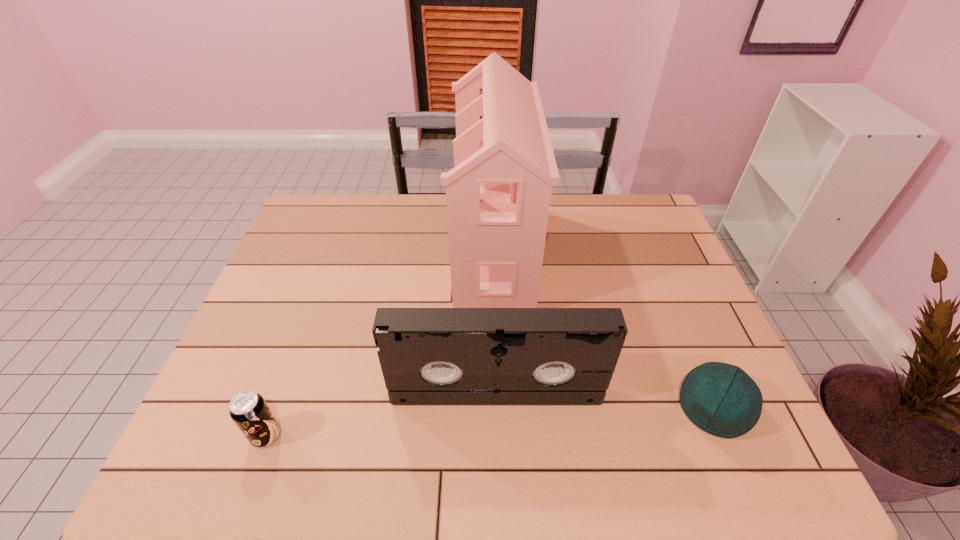
This screenshot has width=960, height=540. I want to click on the tallest object, so click(498, 194).

Locate an element on the screen. The image size is (960, 540). the farthest object is located at coordinates (498, 194).

Identify the location of the second tallest object. This screenshot has width=960, height=540. (428, 356).

Find the location of a particular element. The width and height of the screenshot is (960, 540). soda can is located at coordinates [249, 411].

The width and height of the screenshot is (960, 540). I want to click on the rightmost object, so click(x=721, y=399).

Find the location of a particular element. vacant space located on the front-facing side of the farthest object is located at coordinates (x=394, y=253).

Locate an element on the screen. The width and height of the screenshot is (960, 540). free space located on the front-facing side of the farthest object is located at coordinates [374, 253].

This screenshot has height=540, width=960. Identify the location of vacant space situated on the front-facing side of the farthest object. (399, 253).

Where is `free space located on the side of the third shortest object with visible spindles`? This screenshot has height=540, width=960. free space located on the side of the third shortest object with visible spindles is located at coordinates (498, 453).

The width and height of the screenshot is (960, 540). I want to click on vacant region located 0.330m on the back of the soda can, so click(x=312, y=309).